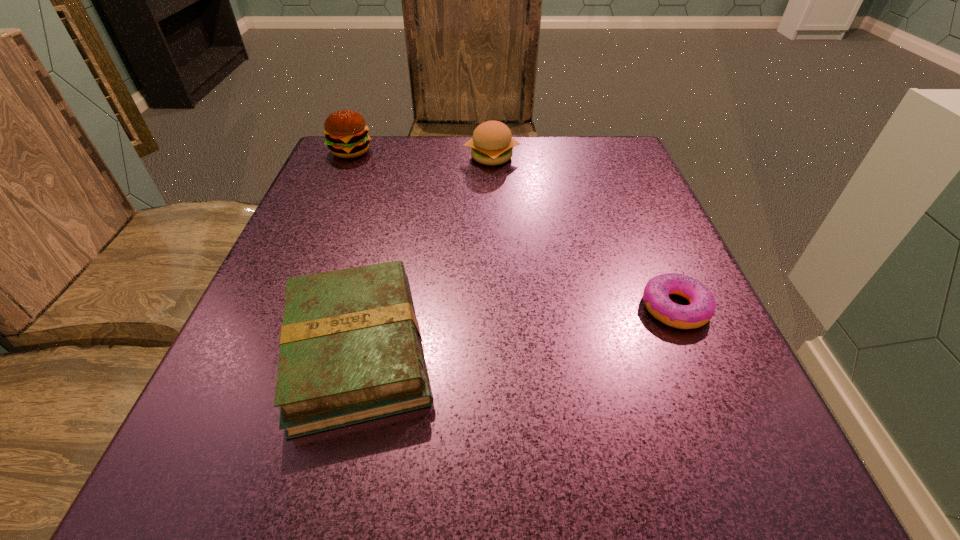
What are the coordinates of `unoccupied area between the right hamburger and the third tallest object` in the screenshot? It's located at (424, 254).

The height and width of the screenshot is (540, 960). I want to click on free space between the left hamburger and the third tallest object, so click(353, 251).

Find the location of a particular element. The image size is (960, 540). the closest object to the book is located at coordinates (656, 299).

Identify which object is the closest to the left hamburger. Please provide its 2D coordinates. Your answer should be formatted as a tuple, i.e. [(x, y)], where the tuple contains the x and y coordinates of a point satisfying the conditions above.

[(492, 144)]

This screenshot has width=960, height=540. Identify the location of free space that satisfies the following two spatial constraints: 1. on the back side of the book; 2. on the right side of the shortest object. (368, 307).

Where is `free space that satisfies the following two spatial constraints: 1. on the front side of the rightmost object; 2. on the right side of the left hamburger`? This screenshot has width=960, height=540. free space that satisfies the following two spatial constraints: 1. on the front side of the rightmost object; 2. on the right side of the left hamburger is located at coordinates (283, 307).

You are a GUI agent. You are given a task and a screenshot of the screen. Output one action in this format:
    pyautogui.click(x=<x>, y=<y>)
    Task: Click on the free spot that satisfies the following two spatial constraints: 1. on the front side of the right hamburger; 2. on the right side of the left hamburger
    Image resolution: width=960 pixels, height=540 pixels.
    Given the screenshot: What is the action you would take?
    pyautogui.click(x=348, y=157)